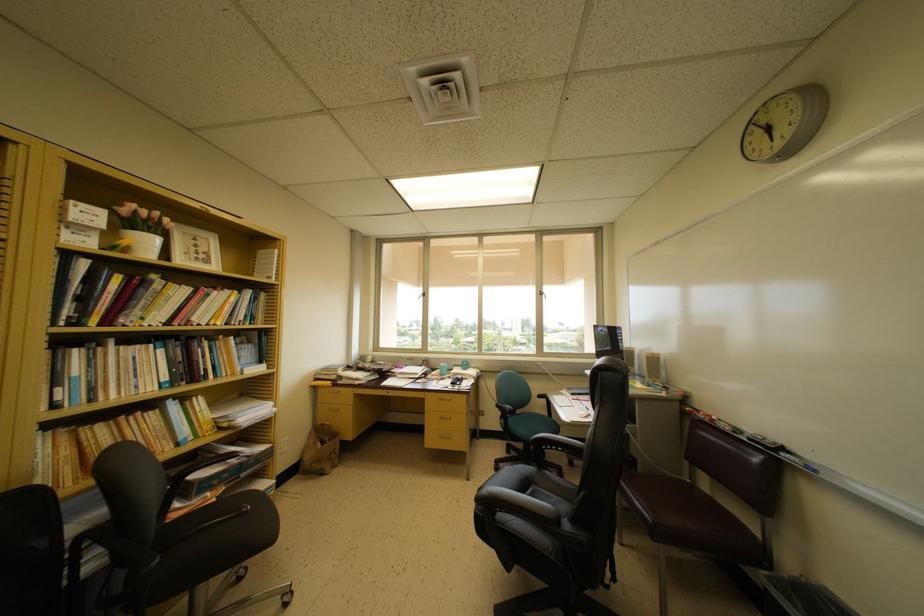
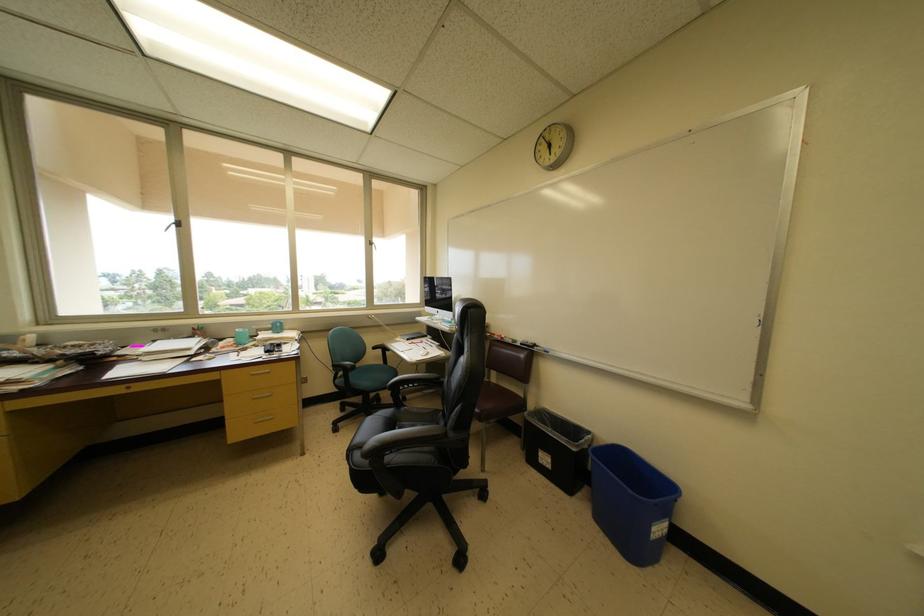
Locate, in the second image, the point that corresponds to [427,299] in the first image.

(179, 225)